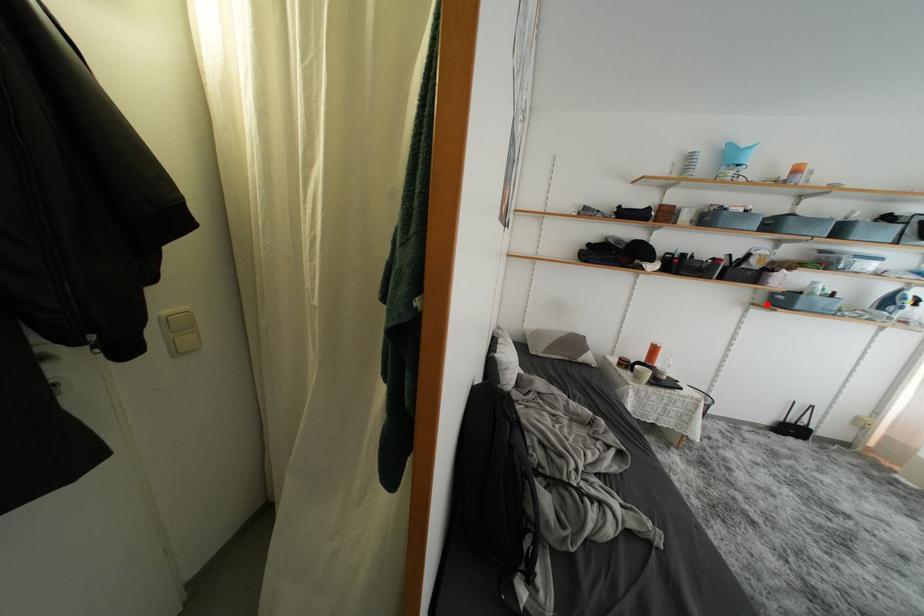
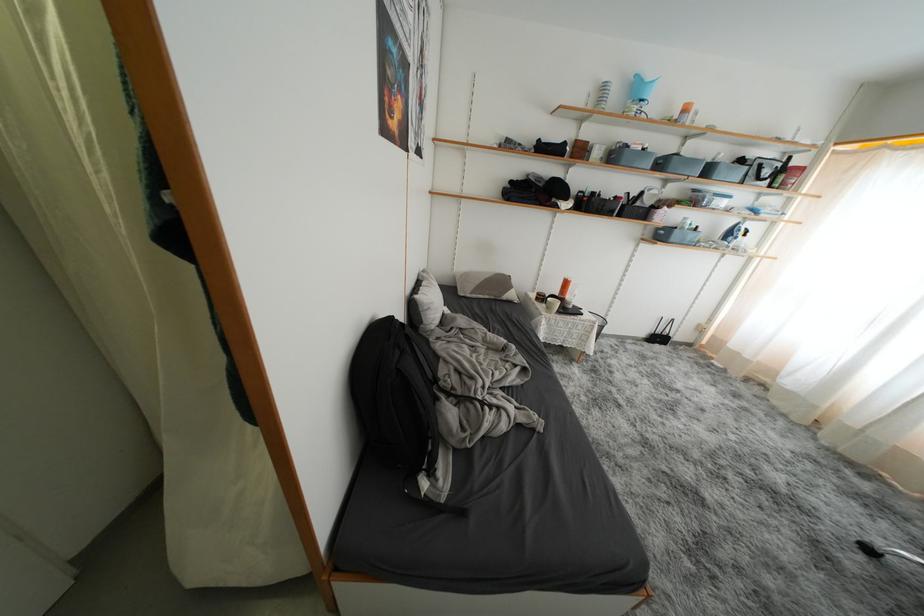
Locate, in the second image, the point that corresponds to the highlighted location in the first image.

(654, 238)